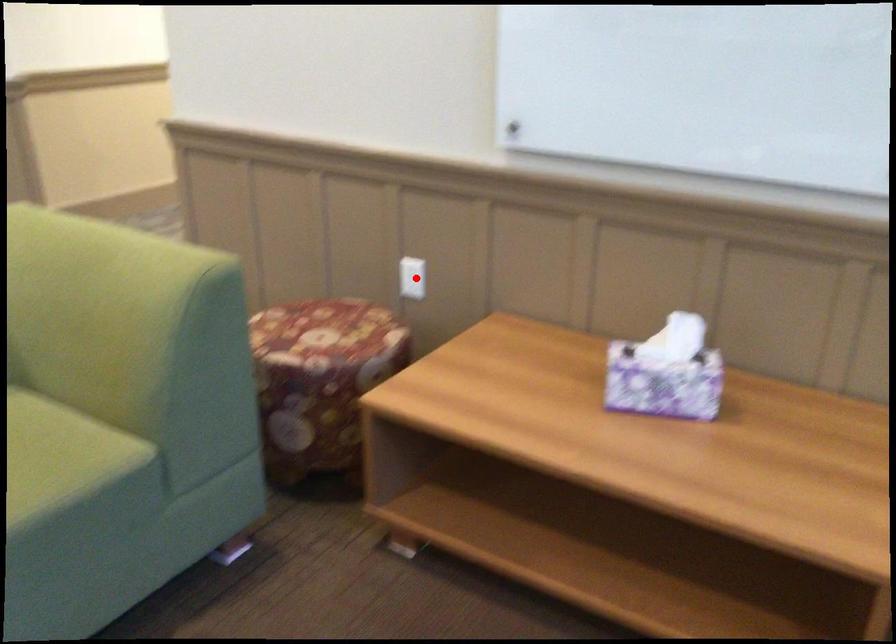
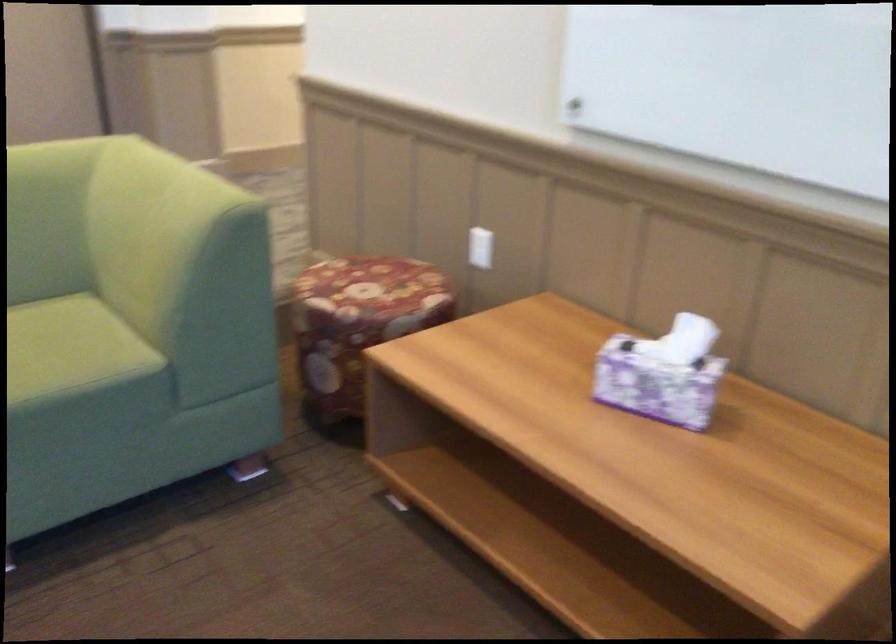
Locate, in the second image, the point that corresponds to the highlighted location in the first image.

(479, 247)